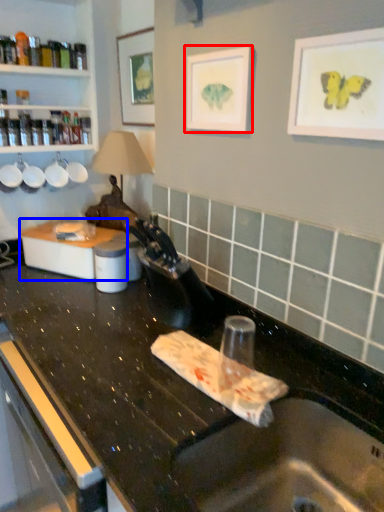
Question: Which object appears farthest to the camera in this image, picture frame (highlighted by a red box) or appliance (highlighted by a blue box)?

Choices:
 (A) picture frame
 (B) appliance

Answer: (B)